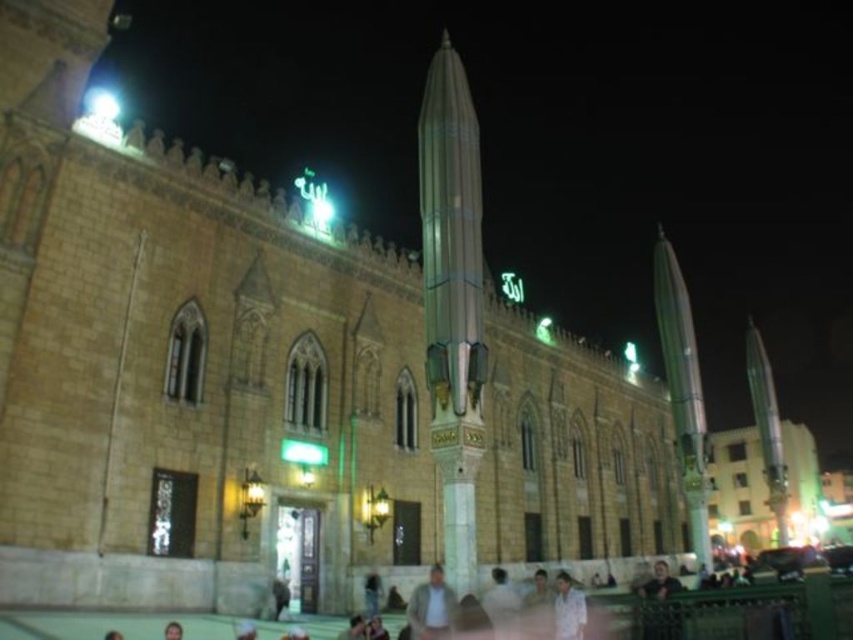
Question: Estimate the real-world distances between objects in this image. Which object is farther from the white cotton shirt at lower center?

Choices:
 (A) green glass spire at center
 (B) light brown leather jacket at center

Answer: (A)

Question: Does green glass spire at center lie behind light brown leather jacket at center?

Choices:
 (A) no
 (B) yes

Answer: (B)

Question: Which point is closer to the camera taking this photo?

Choices:
 (A) (425, 586)
 (B) (560, 596)
 (C) (451, 371)

Answer: (A)

Question: Is green glass spire at center bigger than light brown leather jacket at center?

Choices:
 (A) no
 (B) yes

Answer: (B)

Question: Estimate the real-world distances between objects in this image. Which object is farther from the green glass spire at center?

Choices:
 (A) light brown leather jacket at center
 (B) white cotton shirt at lower center

Answer: (B)

Question: Does green glass spire at center have a larger size compared to light brown leather jacket at center?

Choices:
 (A) no
 (B) yes

Answer: (B)